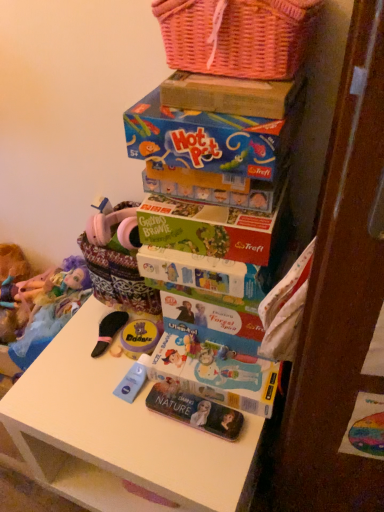
I want to click on vacant space situated on the left part of matte yellow container at center, acting as the 1th toy starting from the front, so click(73, 360).